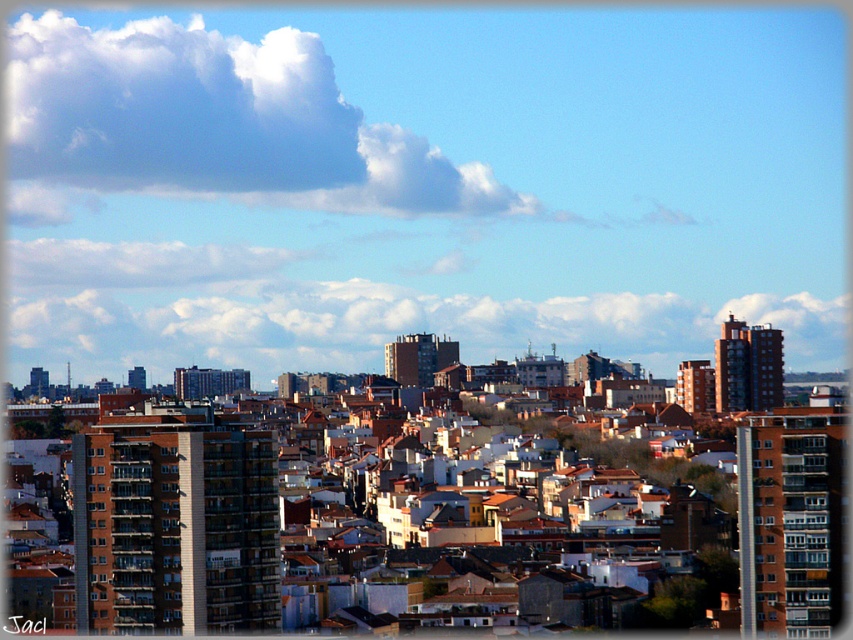
Question: Considering the relative positions of matte concrete buildings at center and white fluffy cloud at upper center in the image provided, where is matte concrete buildings at center located with respect to white fluffy cloud at upper center?

Choices:
 (A) left
 (B) right

Answer: (B)

Question: Does matte concrete buildings at center have a larger size compared to white fluffy cloud at upper center?

Choices:
 (A) yes
 (B) no

Answer: (A)

Question: Which object is farther from the camera taking this photo?

Choices:
 (A) white fluffy cloud at upper center
 (B) white fluffy cloud at center
 (C) matte concrete buildings at center

Answer: (A)

Question: Observing the image, what is the correct spatial positioning of matte concrete buildings at center in reference to white fluffy cloud at center?

Choices:
 (A) right
 (B) left

Answer: (B)

Question: Which object appears closest to the camera in this image?

Choices:
 (A) matte concrete buildings at center
 (B) white fluffy cloud at upper center

Answer: (A)

Question: Considering the real-world distances, which object is closest to the white fluffy cloud at center?

Choices:
 (A) matte concrete buildings at center
 (B) white fluffy cloud at upper center

Answer: (A)